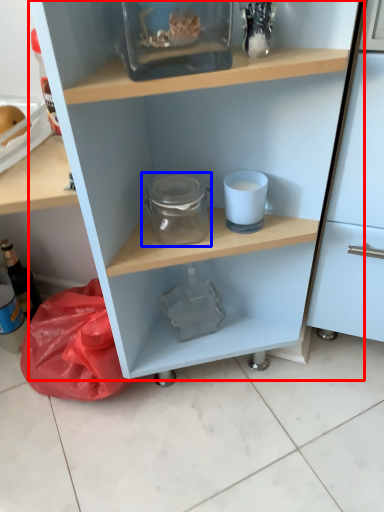
Question: Which of the following is the farthest to the observer, shelf (highlighted by a red box) or glass jar (highlighted by a blue box)?

Choices:
 (A) shelf
 (B) glass jar

Answer: (B)